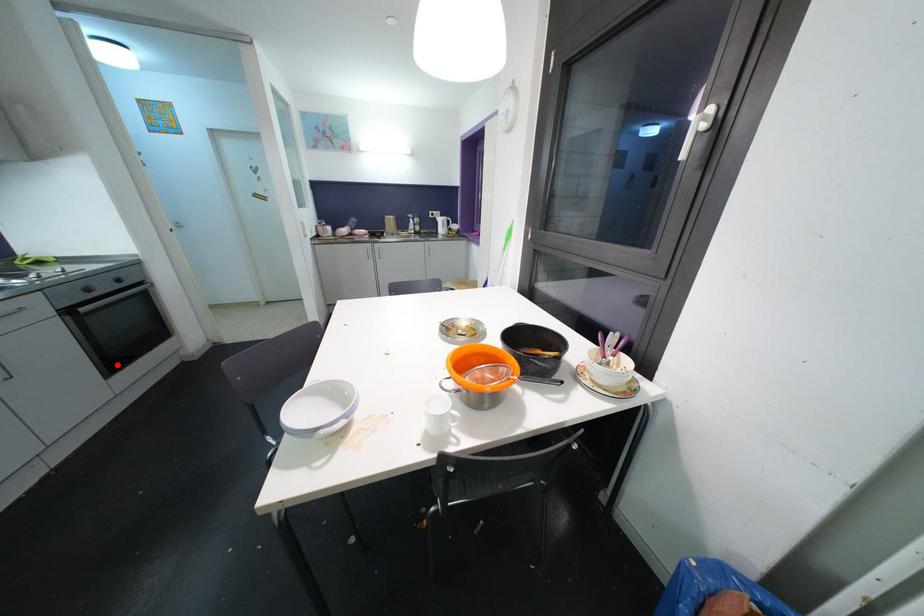
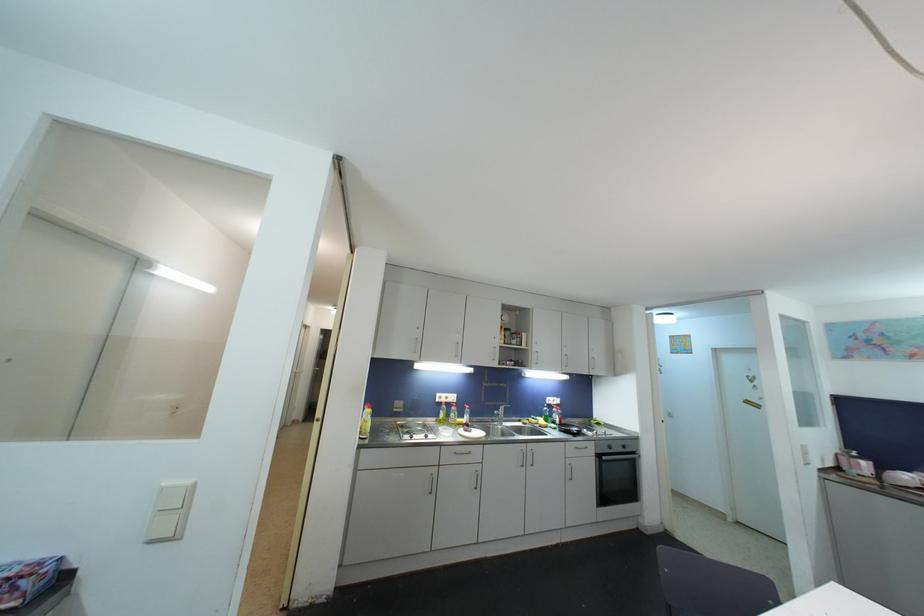
Locate, in the second image, the point that corresponds to the highlighted location in the first image.

(608, 501)